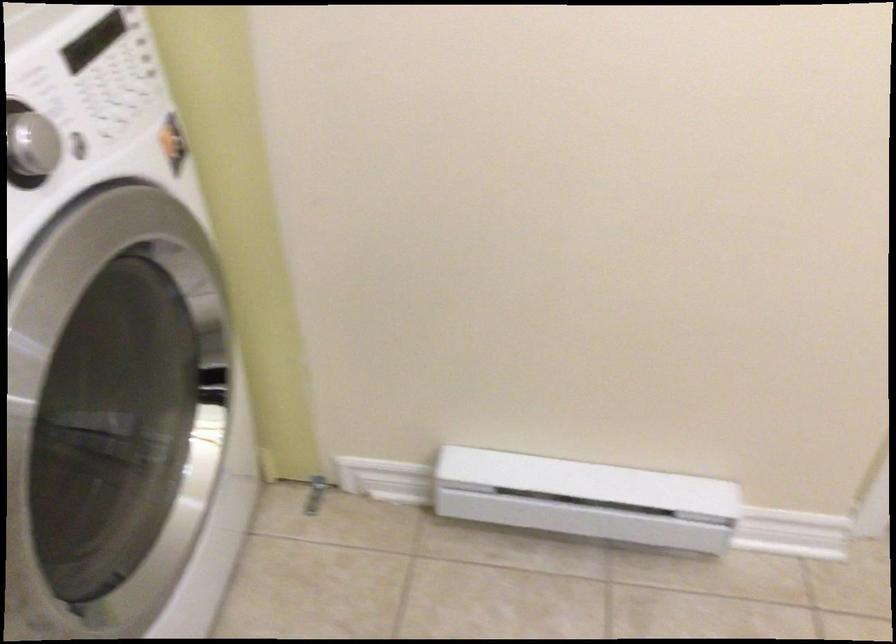
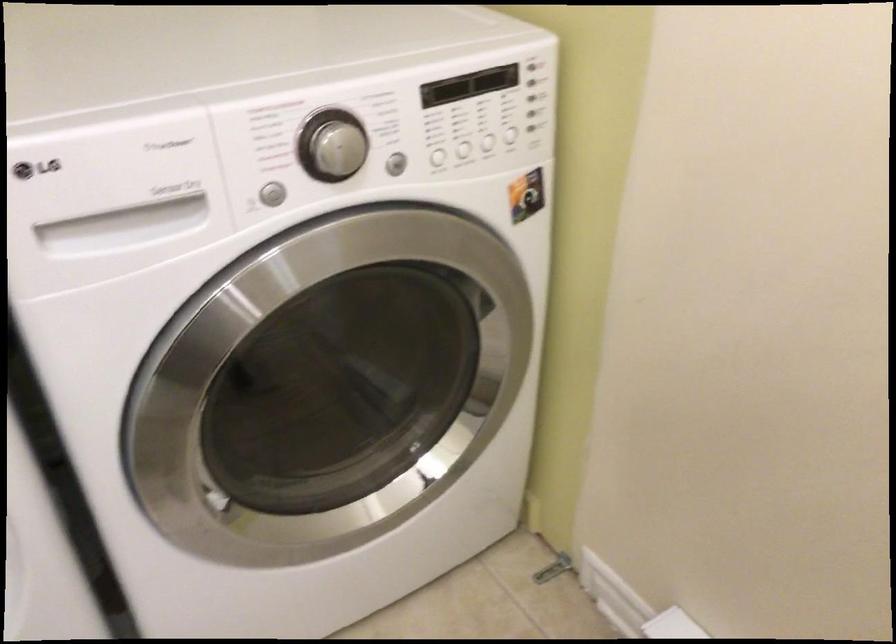
Question: The first image is from the beginning of the video and the second image is from the end. How did the camera likely rotate when shooting the video?

Choices:
 (A) Left
 (B) Right
 (C) Up
 (D) Down

Answer: (A)